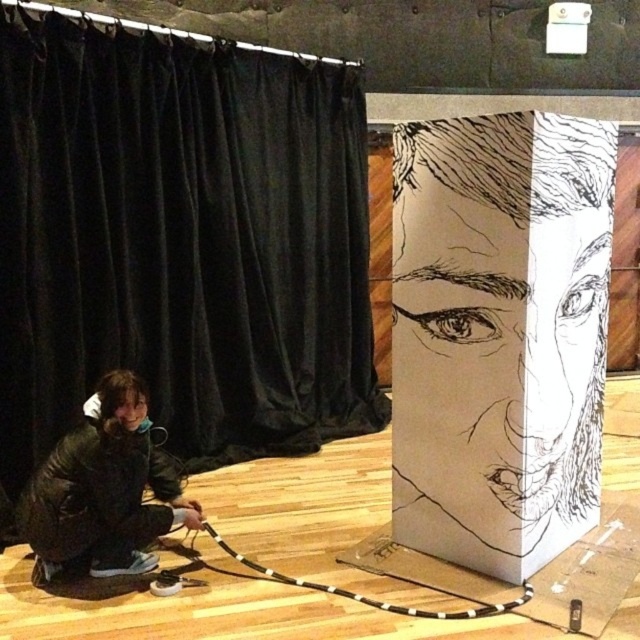
Is black velvet curtain at center taller than white paper drawing at center?

Yes.

Between black velvet curtain at center and white paper drawing at center, which one appears on the left side from the viewer's perspective?

Positioned to the left is black velvet curtain at center.

The height and width of the screenshot is (640, 640). What are the coordinates of `black velvet curtain at center` in the screenshot? It's located at (180, 243).

Is white paper drawing at center smaller than black leather jacket at lower left?

Incorrect, white paper drawing at center is not smaller in size than black leather jacket at lower left.

This screenshot has width=640, height=640. What are the coordinates of `white paper drawing at center` in the screenshot? It's located at (x=499, y=333).

Can you confirm if black velvet curtain at center is thinner than black leather jacket at lower left?

No, black velvet curtain at center is not thinner than black leather jacket at lower left.

Is point (145, 154) positioned before point (132, 392)?

No, it is not.

Describe the element at coordinates (180, 243) in the screenshot. The image size is (640, 640). I see `black velvet curtain at center` at that location.

Where is `black velvet curtain at center`? The width and height of the screenshot is (640, 640). black velvet curtain at center is located at coordinates (180, 243).